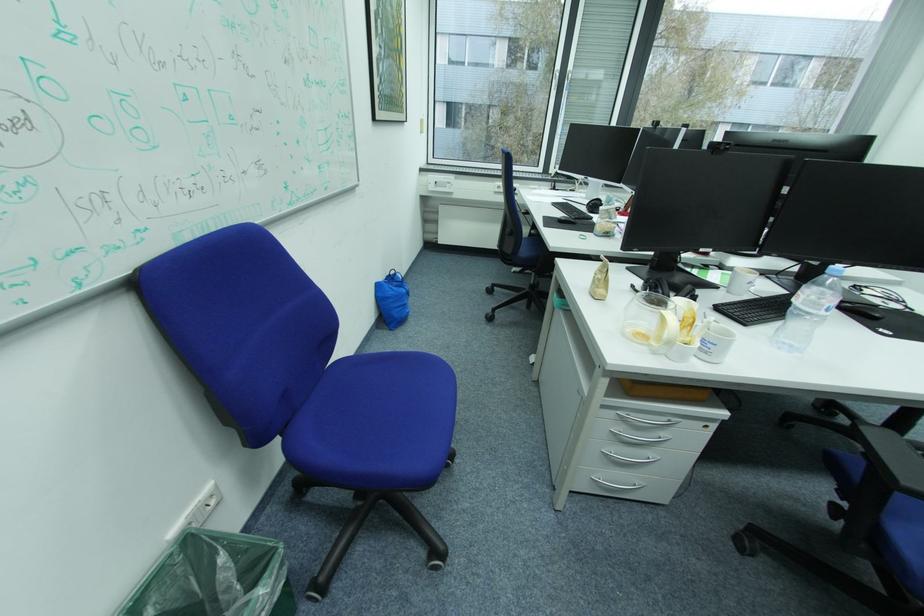
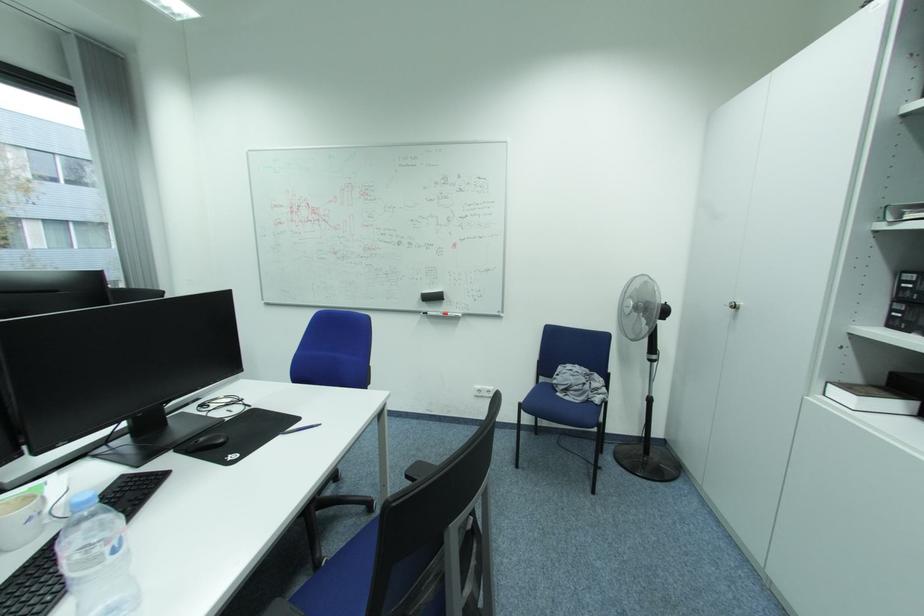
Question: The camera is either moving clockwise (left) or counter-clockwise (right) around the object. The first image is from the beginning of the video and the second image is from the end. Is the camera moving left or right when shooting the video?

Choices:
 (A) Left
 (B) Right

Answer: (A)